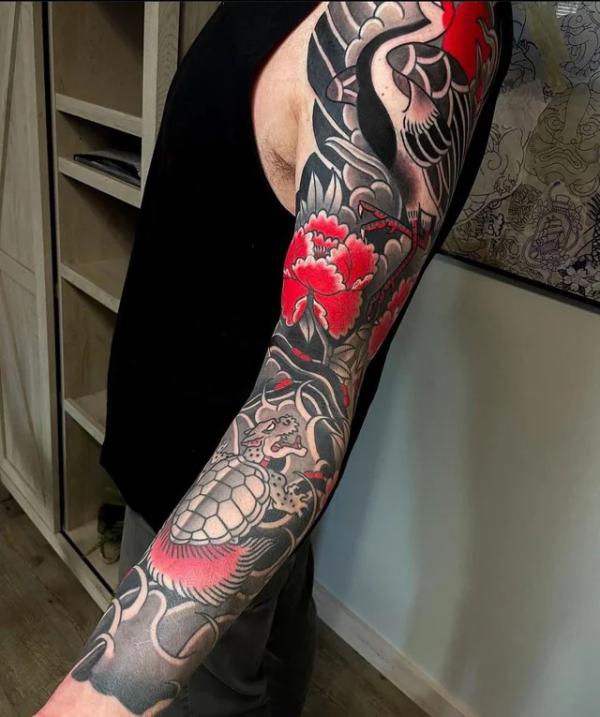
I want to click on white shelves, so click(85, 536), click(93, 409), click(106, 270), click(102, 181), click(121, 117).